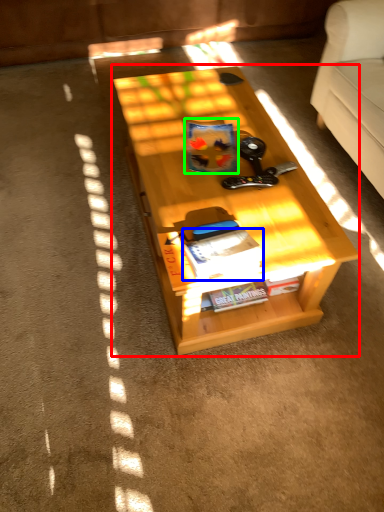
Question: Which is farther away from table (highlighted by a red box)? magazine (highlighted by a blue box) or book (highlighted by a green box)?

Choices:
 (A) magazine
 (B) book

Answer: (A)